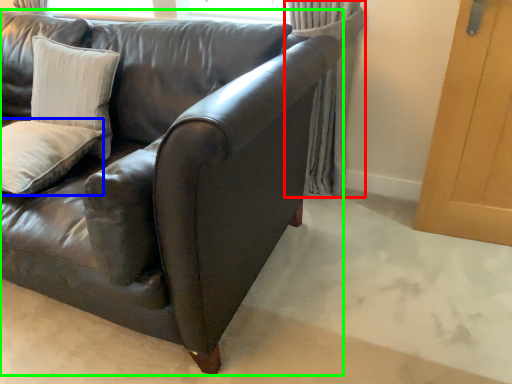
Question: Which is farther away from curtain (highlighted by a red box)? pillow (highlighted by a blue box) or studio couch (highlighted by a green box)?

Choices:
 (A) pillow
 (B) studio couch

Answer: (A)